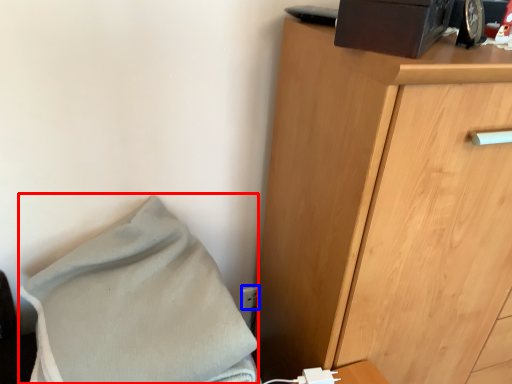
Question: Which object appears closest to the camera in this image, blanket (highlighted by a red box) or electric outlet (highlighted by a blue box)?

Choices:
 (A) blanket
 (B) electric outlet

Answer: (A)